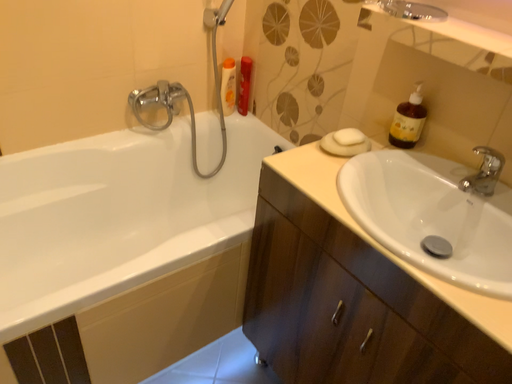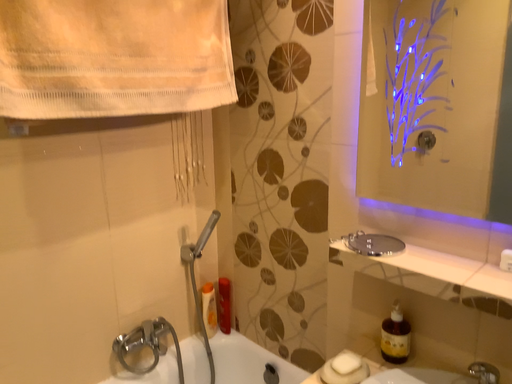
Question: Which way did the camera rotate in the video?

Choices:
 (A) rotated downward
 (B) rotated upward

Answer: (B)